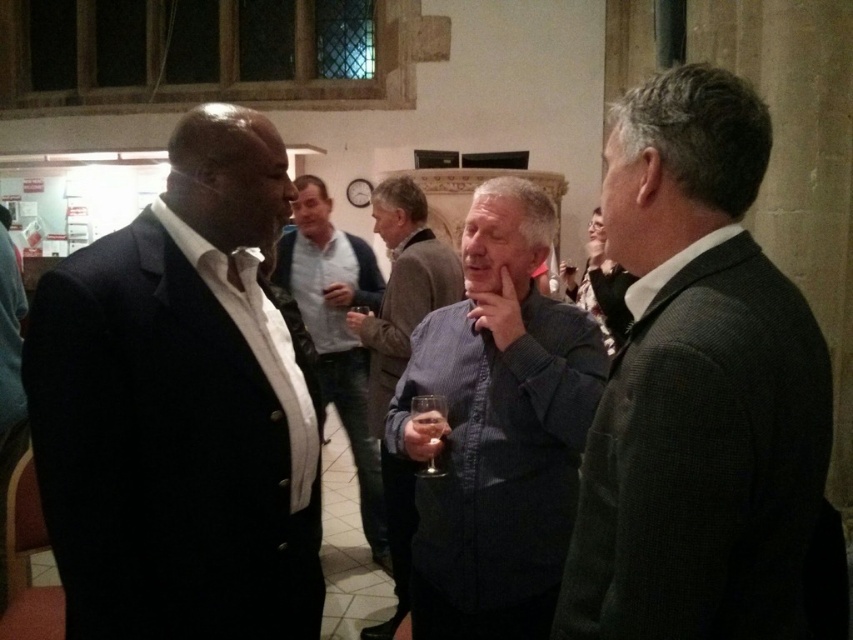
Question: Can you confirm if dark gray suit at right is positioned below gray striped shirt at center?

Choices:
 (A) no
 (B) yes

Answer: (A)

Question: Which point is farther to the camera?

Choices:
 (A) matte black shirt at center
 (B) dark gray suit at right
 (C) matte black suit at left
 (D) clear glass wine glass at center

Answer: (A)

Question: Which point is farther to the camera?

Choices:
 (A) (405, 317)
 (B) (625, 364)
 (C) (242, 504)
 (D) (438, 474)

Answer: (A)

Question: Which point is farther from the camera taking this photo?

Choices:
 (A) (379, 474)
 (B) (570, 428)

Answer: (A)

Question: Does matte black suit at left have a lesser width compared to dark gray suit at right?

Choices:
 (A) yes
 (B) no

Answer: (A)

Question: Is dark gray suit at right smaller than gray striped shirt at center?

Choices:
 (A) yes
 (B) no

Answer: (A)